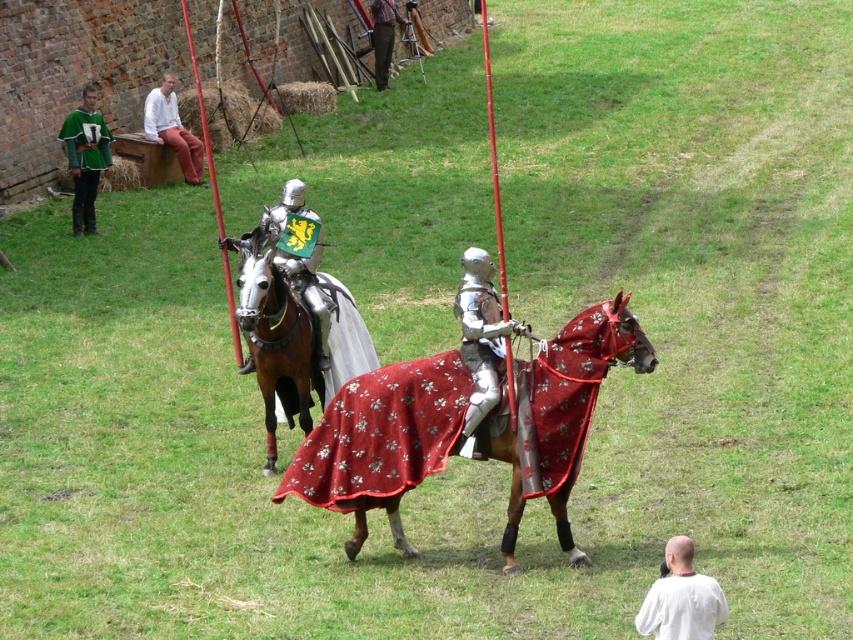
Question: Is green jersey at left closer to camera compared to shiny silver armor at center?

Choices:
 (A) no
 (B) yes

Answer: (A)

Question: Which object is positioned closest to the white cotton shirt at upper left?

Choices:
 (A) shiny silver armor at center
 (B) polished silver armor at center

Answer: (A)

Question: Considering the relative positions of white matte shirt at lower right and white cotton shirt at upper left in the image provided, where is white matte shirt at lower right located with respect to white cotton shirt at upper left?

Choices:
 (A) right
 (B) left

Answer: (A)

Question: Which of the following is the farthest from the observer?

Choices:
 (A) (74, 122)
 (B) (525, 365)
 (C) (468, 401)
 (D) (296, 358)

Answer: (A)

Question: Which point is farther from the camera taking this photo?

Choices:
 (A) pyautogui.click(x=486, y=381)
 (B) pyautogui.click(x=285, y=408)

Answer: (B)

Question: Where is shiny metallic horse at center located in relation to green wool sweater at upper left in the image?

Choices:
 (A) left
 (B) right

Answer: (B)